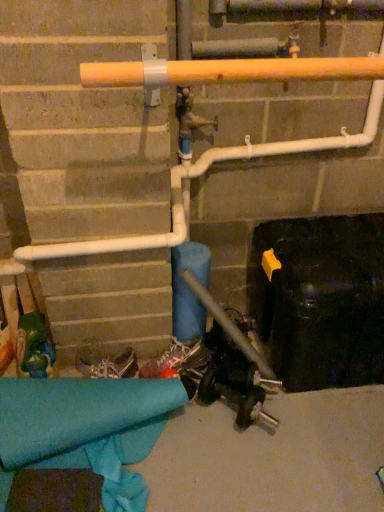
Question: Based on their sizes in the image, would you say white textured sneakers at center is bigger or smaller than matte orange pipe at upper center?

Choices:
 (A) big
 (B) small

Answer: (B)

Question: From a real-world perspective, relative to matte orange pipe at upper center, is white textured sneakers at center vertically above or below?

Choices:
 (A) above
 (B) below

Answer: (B)

Question: In terms of width, does white textured sneakers at center look wider or thinner when compared to matte orange pipe at upper center?

Choices:
 (A) thin
 (B) wide

Answer: (A)

Question: From a real-world perspective, is matte orange pipe at upper center above or below white textured sneakers at center?

Choices:
 (A) above
 (B) below

Answer: (A)

Question: Is matte orange pipe at upper center spatially inside white textured sneakers at center, or outside of it?

Choices:
 (A) inside
 (B) outside

Answer: (B)

Question: Considering the positions of matte orange pipe at upper center and white textured sneakers at center in the image, is matte orange pipe at upper center wider or thinner than white textured sneakers at center?

Choices:
 (A) thin
 (B) wide

Answer: (B)

Question: In terms of height, does matte orange pipe at upper center look taller or shorter compared to white textured sneakers at center?

Choices:
 (A) tall
 (B) short

Answer: (B)